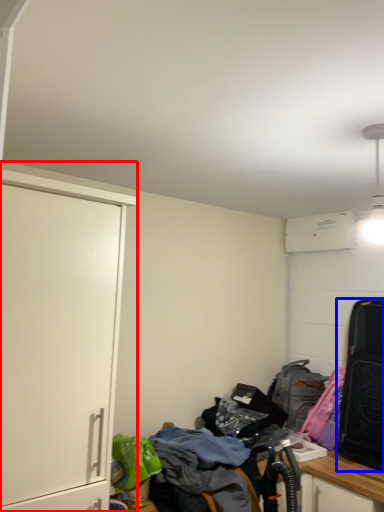
Question: Which of the following is the farthest to the observer, cabinetry (highlighted by a red box) or luggage and bags (highlighted by a blue box)?

Choices:
 (A) cabinetry
 (B) luggage and bags

Answer: (B)